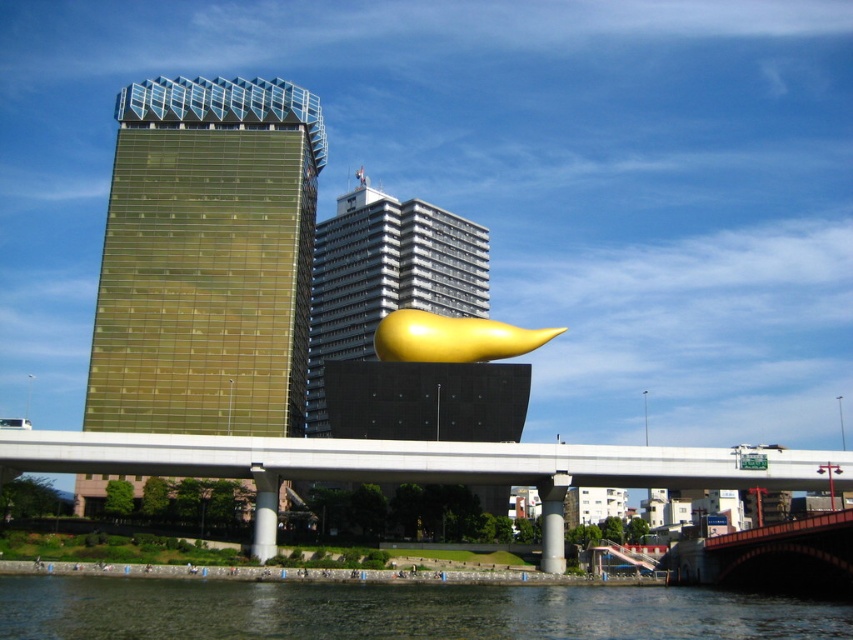
You are a tourist standing on the sidewalk near the greenish water at lower center and want to take a photo of the concrete bridge at center. Is the bridge fully visible from your current position?

The greenish water at lower center is located below the concrete bridge at center, so the bridge is partially obstructed by the water. Therefore, the bridge is not fully visible from your current position.

You are a photographer planning to capture the golden sculpture and the bridge in one shot. Given that the gold reflective glass tower at left is blocking part of the bridge, can you still see the entire concrete bridge at center in your photo?

The gold reflective glass tower at left is above the concrete bridge at center, so part of the bridge may be obscured by the tower. Therefore, you might not see the entire concrete bridge at center in your photo.

You are standing at the point marked by coordinates point (396,611) in the image. Based on the scene description, what would you most likely see around you?

You would most likely see greenish water at lower center around you, as the coordinates point (396,611) indicates greenish water at lower center.